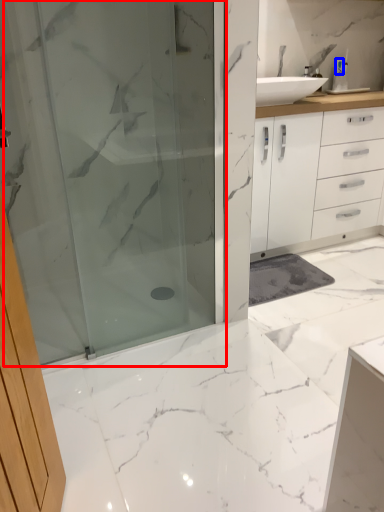
Question: Among these objects, which one is nearest to the camera, shower door (highlighted by a red box) or toiletry (highlighted by a blue box)?

Choices:
 (A) shower door
 (B) toiletry

Answer: (A)